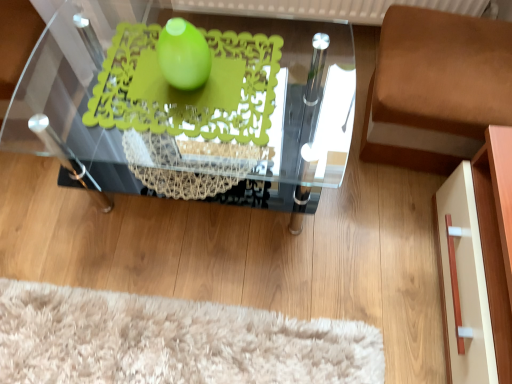
Question: Considering their positions, is transparent glass table at center located in front of or behind brown fabric cushion at right?

Choices:
 (A) front
 (B) behind

Answer: (A)

Question: Considering the relative positions of transparent glass table at center and brown fabric cushion at right in the image provided, is transparent glass table at center to the left or to the right of brown fabric cushion at right?

Choices:
 (A) left
 (B) right

Answer: (A)

Question: Estimate the real-world distances between objects in this image. Which object is farther from the brown fabric cushion at right?

Choices:
 (A) transparent glass table at center
 (B) green matte doily at center
 (C) green matte sphere at center

Answer: (C)

Question: Considering the real-world distances, which object is closest to the green matte doily at center?

Choices:
 (A) transparent glass table at center
 (B) green matte sphere at center
 (C) brown fabric cushion at right

Answer: (B)